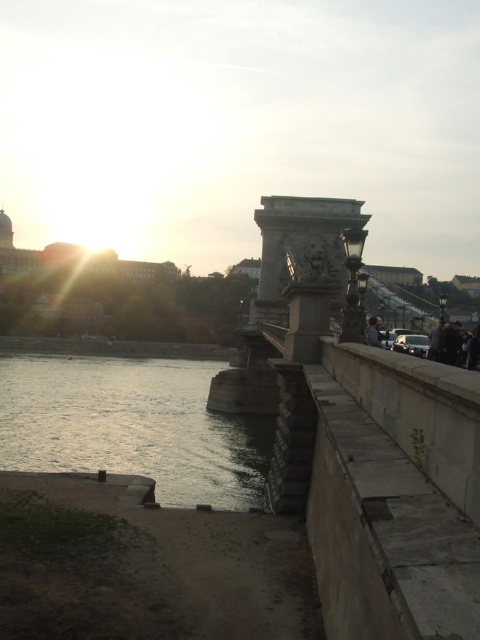
You are standing at the riverside and want to reach the point marked by coordinates point (35, 369). Given that your walking speed is 1.5 meters per second, how long will it take you to reach that point?

The point (35, 369) is 93.66 meters away from the viewer. At a walking speed of 1.5 meters per second, it would take approximately 62.44 seconds to reach the point.

You are standing on the stone bridge and see the silvery reflective water at lower left and the dark gray fabric jacket at right. Which object is closer to the bridge?

The dark gray fabric jacket at right is closer to the bridge because the silvery reflective water at lower left is positioned under it, indicating the jacket is above the water.